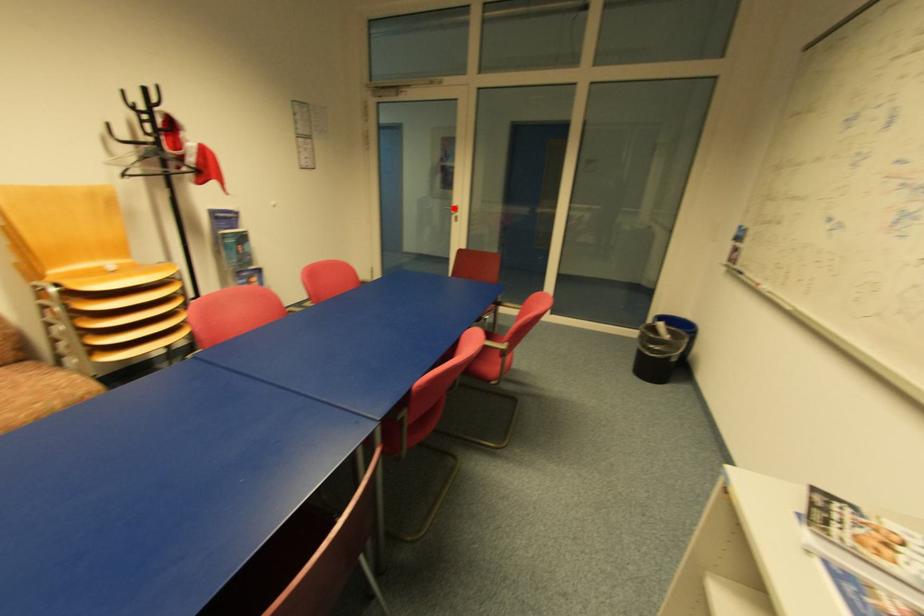
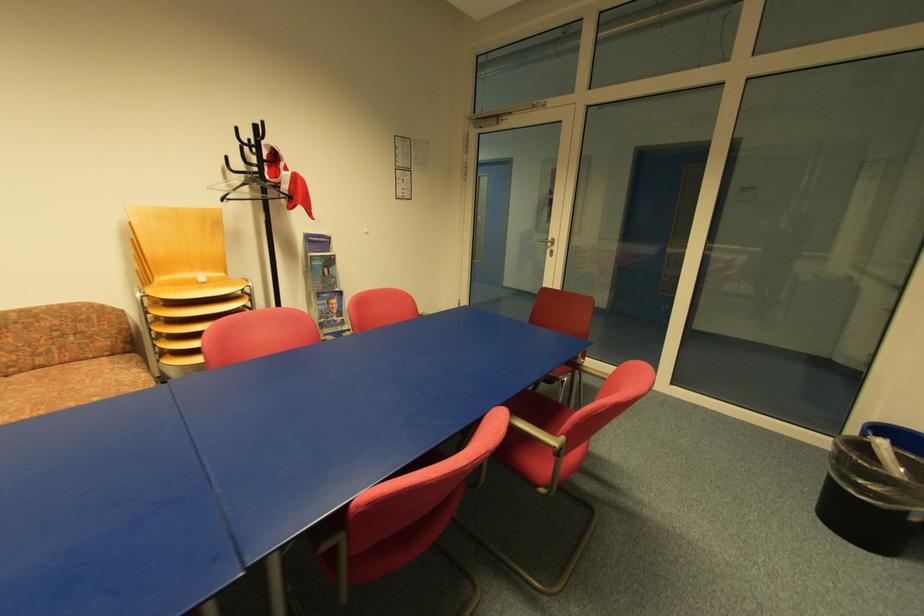
Where in the second image is the point corresponding to the highlighted location from the first image?

(551, 241)